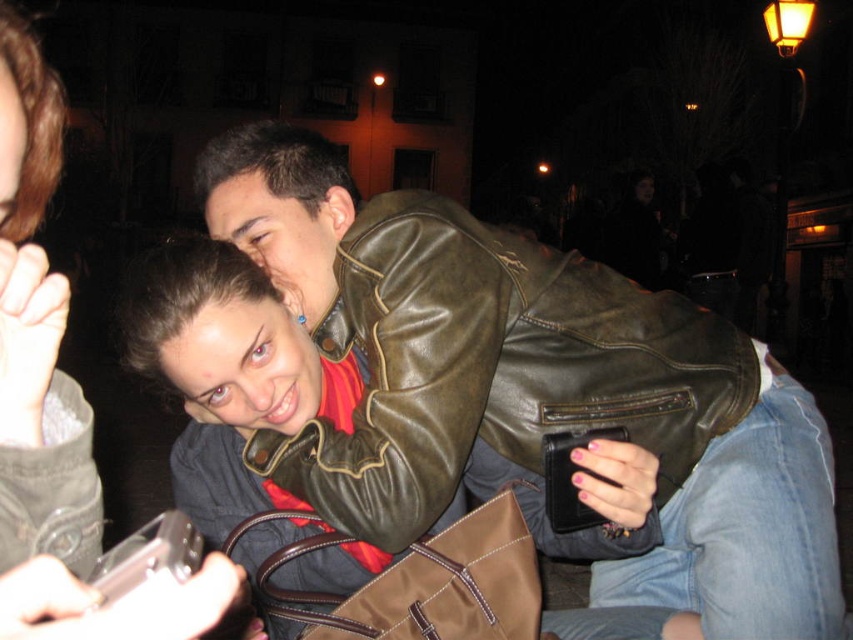
Can you confirm if shiny brown leather jacket at center is bigger than matte black phone at lower left?

Yes.

This screenshot has height=640, width=853. Describe the element at coordinates (494, 365) in the screenshot. I see `shiny brown leather jacket at center` at that location.

Locate an element on the screen. This screenshot has width=853, height=640. shiny brown leather jacket at center is located at coordinates tap(494, 365).